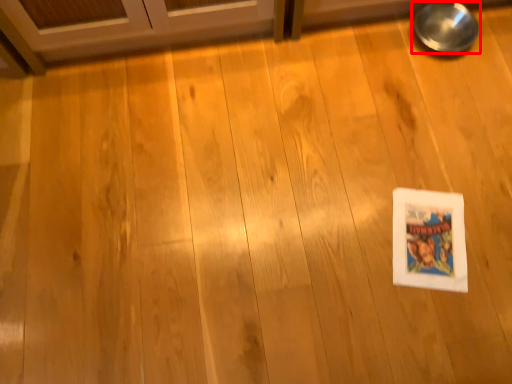
Question: From the image's perspective, what is the correct spatial positioning of bowl (annotated by the red box) in reference to comic book?

Choices:
 (A) above
 (B) below

Answer: (A)